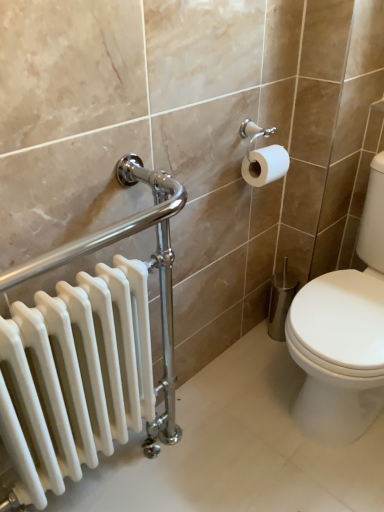
Question: Is white glossy radiator at left positioned behind white glossy toilet at right?

Choices:
 (A) no
 (B) yes

Answer: (A)

Question: Is white glossy radiator at left turned away from white glossy toilet at right?

Choices:
 (A) no
 (B) yes

Answer: (A)

Question: Is white glossy radiator at left thinner than white glossy toilet at right?

Choices:
 (A) yes
 (B) no

Answer: (A)

Question: Is the surface of white glossy radiator at left in direct contact with white glossy toilet at right?

Choices:
 (A) yes
 (B) no

Answer: (B)

Question: From the image's perspective, is white glossy radiator at left over white glossy toilet at right?

Choices:
 (A) yes
 (B) no

Answer: (B)

Question: Considering the relative positions of white glossy radiator at left and white glossy toilet at right in the image provided, is white glossy radiator at left in front of white glossy toilet at right?

Choices:
 (A) yes
 (B) no

Answer: (A)

Question: From the image's perspective, is white glossy toilet at right on top of white glossy radiator at left?

Choices:
 (A) no
 (B) yes

Answer: (B)

Question: Is white glossy toilet at right positioned far away from white glossy radiator at left?

Choices:
 (A) yes
 (B) no

Answer: (B)

Question: Is white glossy toilet at right at the left side of white glossy radiator at left?

Choices:
 (A) yes
 (B) no

Answer: (B)

Question: Is white glossy toilet at right located outside white glossy radiator at left?

Choices:
 (A) no
 (B) yes

Answer: (B)

Question: Considering the relative sizes of white glossy toilet at right and white glossy radiator at left in the image provided, is white glossy toilet at right shorter than white glossy radiator at left?

Choices:
 (A) yes
 (B) no

Answer: (A)

Question: Is white glossy toilet at right positioned before white glossy radiator at left?

Choices:
 (A) yes
 (B) no

Answer: (B)

Question: Considering the relative sizes of white glossy toilet at right and white matte toilet paper at upper right in the image provided, is white glossy toilet at right taller than white matte toilet paper at upper right?

Choices:
 (A) no
 (B) yes

Answer: (B)